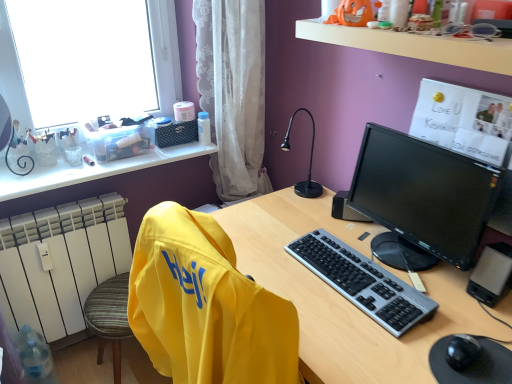
At what (x,y) coordinates should I click in order to perform the action: click on vacant space behind black plastic keyboard at center. Please return your answer as a coordinate pair (x, y). The width and height of the screenshot is (512, 384). Looking at the image, I should click on (331, 228).